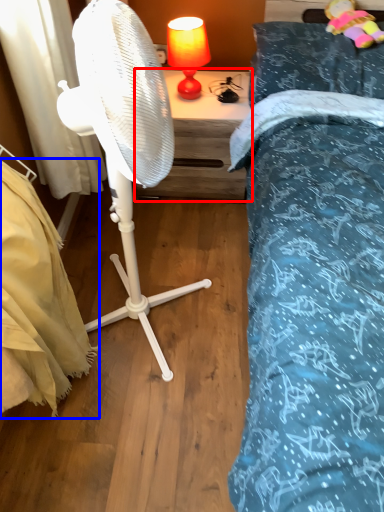
Question: Which of the following is the farthest to the observer, nightstand (highlighted by a red box) or mattress (highlighted by a blue box)?

Choices:
 (A) nightstand
 (B) mattress

Answer: (A)